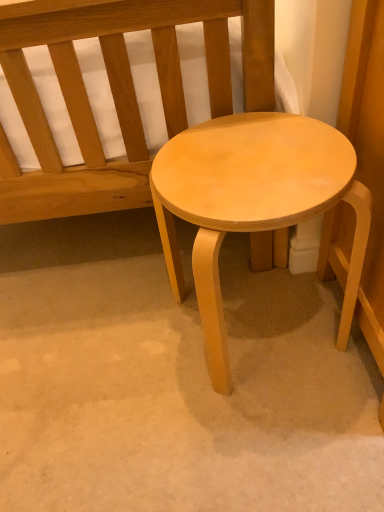
What do you see at coordinates (251, 202) in the screenshot?
I see `light wood stool at center` at bounding box center [251, 202].

Where is `light wood stool at center`? The width and height of the screenshot is (384, 512). light wood stool at center is located at coordinates (251, 202).

You are a GUI agent. You are given a task and a screenshot of the screen. Output one action in this format:
    pyautogui.click(x=<x>, y=<y>)
    Task: Click on the light wood stool at center
    The image size is (384, 512).
    Given the screenshot: What is the action you would take?
    pyautogui.click(x=251, y=202)